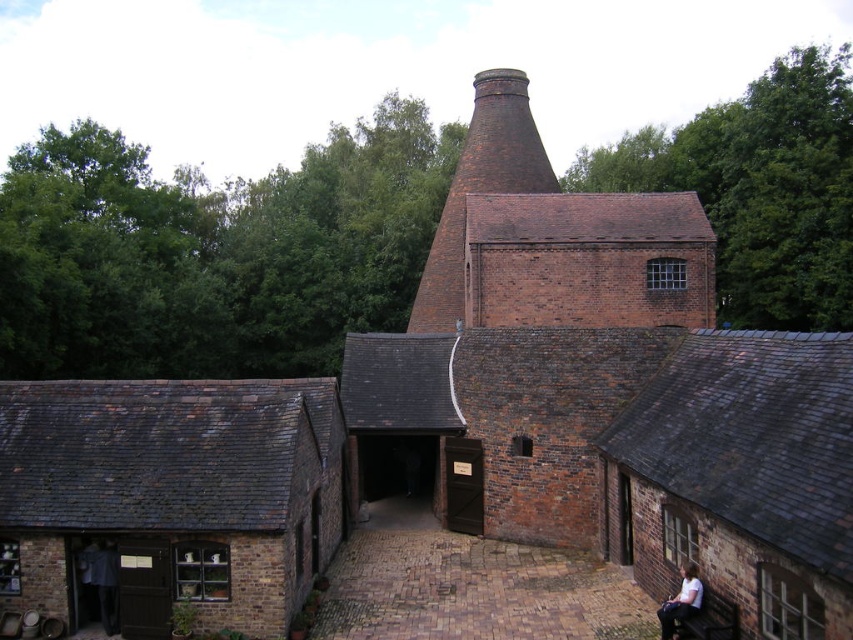
You are standing in front of the traditional brick structure. You see the brown brick chimney at center and the white cotton shirt at lower right. Which object is closer to you?

The brown brick chimney at center is closer to you because the white cotton shirt at lower right is behind it.

You are standing in front of the traditional brick structure and want to locate the point at coordinates (480, 188). Based on the scene description, can you tell me which part of the structure this point is located on?

The point at coordinates (480, 188) is located on the brown brick chimney at center.

You are standing at the entrance of the brick building and need to reach the white cotton shirt at lower right without getting too close to the brown brick chimney at center. Can you walk directly towards the shirt while maintaining a safe distance of at least 30 meters from the chimney?

The brown brick chimney at center and white cotton shirt at lower right are 31.00 meters apart. Since the required safe distance is 30 meters, you can walk directly towards the shirt while maintaining the required distance from the chimney.